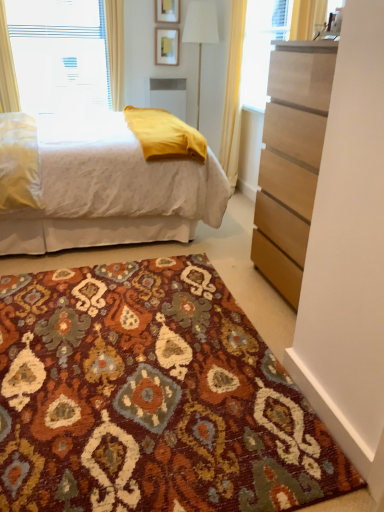
Question: Is point (122, 99) positioned closer to the camera than point (198, 73)?

Choices:
 (A) closer
 (B) farther

Answer: (A)

Question: Is white plastic window at upper left situated inside white fabric lampshade at center or outside?

Choices:
 (A) inside
 (B) outside

Answer: (B)

Question: Which is nearer to the white plastic window at upper left?

Choices:
 (A) white textured bed at center
 (B) matte gold picture frame at upper center, which is the second picture frame in top-to-bottom order
 (C) wooden picture frame at upper center, placed as the second picture frame when sorted from bottom to top
 (D) light brown wood chest of drawers at right
 (E) white sheer curtain at upper left, which is the 2th curtain from right to left

Answer: (B)

Question: Considering the real-world distances, which object is closest to the yellow fabric curtain at upper right, the first curtain in the right-to-left sequence?

Choices:
 (A) white sheer curtain at upper left, the first curtain from the left
 (B) matte gold picture frame at upper center, which is the second picture frame in top-to-bottom order
 (C) wooden picture frame at upper center, positioned as the 1th picture frame in top-to-bottom order
 (D) light brown wood chest of drawers at right
 (E) multicolored woven rug at center

Answer: (B)